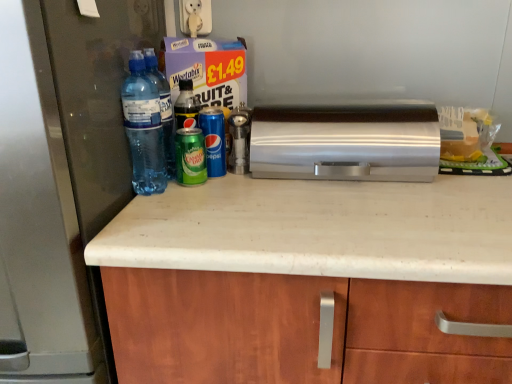
Question: Considering the positions of point (147, 155) and point (247, 157), is point (147, 155) closer or farther from the camera than point (247, 157)?

Choices:
 (A) farther
 (B) closer

Answer: (B)

Question: Do you think transparent plastic water bottles at left, the 1th bottle positioned from the left, is within metallic silver shaker at center, or outside of it?

Choices:
 (A) outside
 (B) inside

Answer: (A)

Question: Estimate the real-world distances between objects in this image. Which object is closer to the metallic silver shaker at center?

Choices:
 (A) green matte can at center
 (B) silver metallic bread bin at center
 (C) matte black refrigerator at left
 (D) blue metallic can at center, positioned as the third bottle in left-to-right order
 (E) green matte can at center, arranged as the 2th bottle when viewed from the right

Answer: (D)

Question: Estimate the real-world distances between objects in this image. Which object is closer to the green matte can at center, arranged as the 2th bottle when viewed from the right?

Choices:
 (A) transparent plastic water bottles at left, which is the third bottle from right to left
 (B) blue metallic can at center, positioned as the third bottle in left-to-right order
 (C) metallic silver shaker at center
 (D) silver metallic bread bin at center
 (E) green matte can at center

Answer: (B)